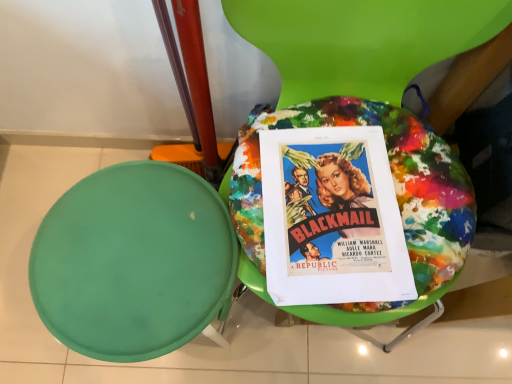
I want to click on free spot above green matte stool at left (from a real-world perspective), so click(x=133, y=254).